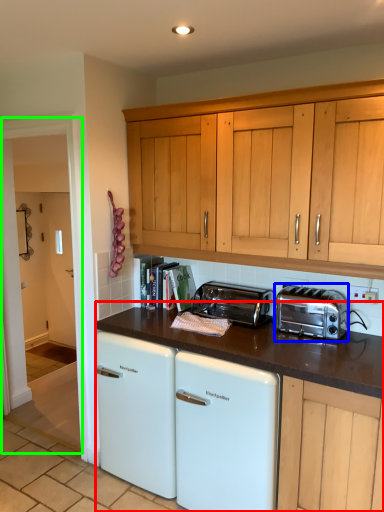
Question: Which is nearer to the appliance (highlighted by a red box)? toaster (highlighted by a blue box) or glass door (highlighted by a green box).

Choices:
 (A) toaster
 (B) glass door

Answer: (A)